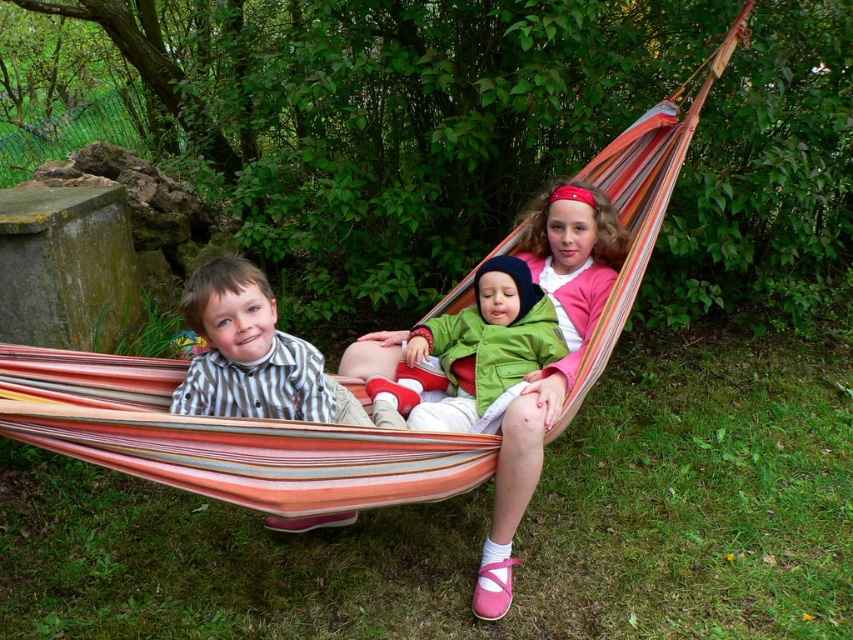
From the picture: Does striped cotton shirt at center have a lesser height compared to green matte jacket at center?

Yes, striped cotton shirt at center is shorter than green matte jacket at center.

Where is `striped cotton shirt at center`? striped cotton shirt at center is located at coordinates (252, 355).

Locate an element on the screen. striped cotton shirt at center is located at coordinates 252,355.

Is striped fabric hammock at center taller than green matte jacket at center?

Indeed, striped fabric hammock at center has a greater height compared to green matte jacket at center.

Can you confirm if striped fabric hammock at center is bigger than green matte jacket at center?

Correct, striped fabric hammock at center is larger in size than green matte jacket at center.

Who is more distant from viewer, (548, 394) or (451, 392)?

Positioned behind is point (451, 392).

This screenshot has height=640, width=853. Identify the location of striped fabric hammock at center. (370, 429).

Is striped fabric hammock at center bigger than striped cotton shirt at center?

Indeed, striped fabric hammock at center has a larger size compared to striped cotton shirt at center.

Is point (556, 204) more distant than point (223, 285)?

Yes, it is behind point (223, 285).

Where is `striped fabric hammock at center`? striped fabric hammock at center is located at coordinates (370, 429).

Locate an element on the screen. This screenshot has height=640, width=853. striped fabric hammock at center is located at coordinates (370, 429).